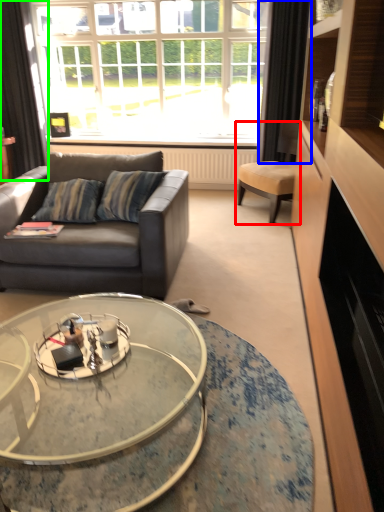
Question: Based on their relative distances, which object is nearer to chair (highlighted by a red box)? Choose from curtain (highlighted by a blue box) and curtain (highlighted by a green box).

Choices:
 (A) curtain
 (B) curtain

Answer: (A)